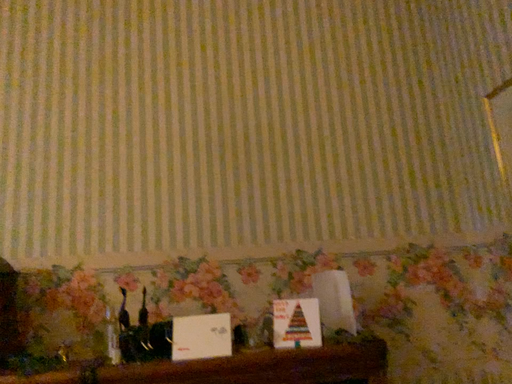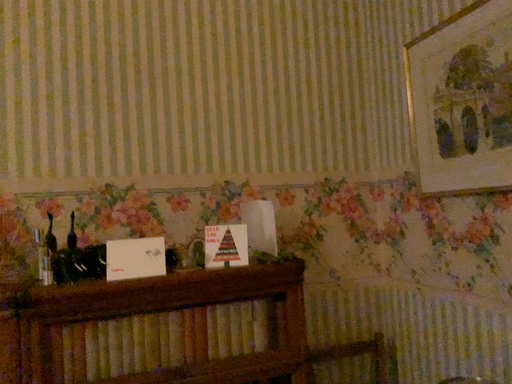
Question: How did the camera likely rotate when shooting the video?

Choices:
 (A) rotated upward
 (B) rotated downward

Answer: (B)